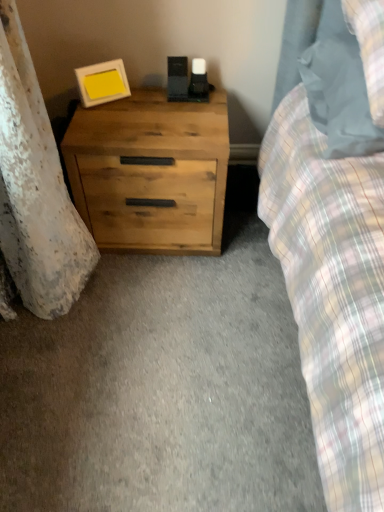
Question: In the image, is matte white picture frame at upper left positioned in front of or behind natural wood chest of drawers at lower left?

Choices:
 (A) front
 (B) behind

Answer: (B)

Question: Is point (100, 69) closer or farther from the camera than point (97, 151)?

Choices:
 (A) farther
 (B) closer

Answer: (A)

Question: Which is farther from the matte gray pillow at upper right?

Choices:
 (A) matte white picture frame at upper left
 (B) natural wood chest of drawers at lower left

Answer: (A)

Question: Which object is positioned farthest from the matte white picture frame at upper left?

Choices:
 (A) natural wood chest of drawers at lower left
 (B) matte gray pillow at upper right

Answer: (B)